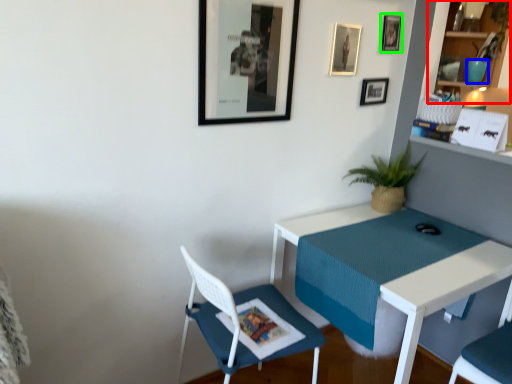
Question: Which object is the closest to the shelf (highlighted by a red box)? Choose among these: teal (highlighted by a blue box) or picture frame (highlighted by a green box).

Choices:
 (A) teal
 (B) picture frame

Answer: (A)